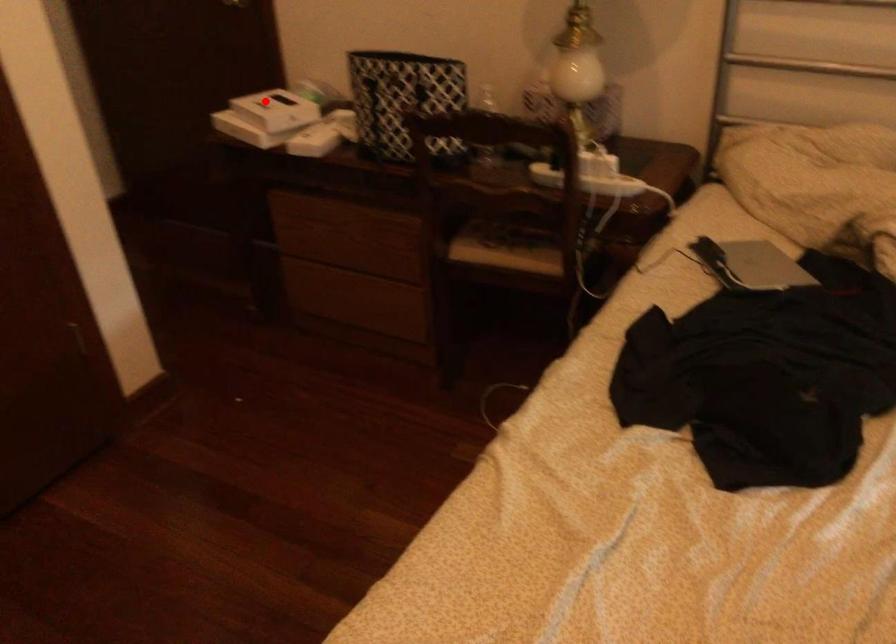
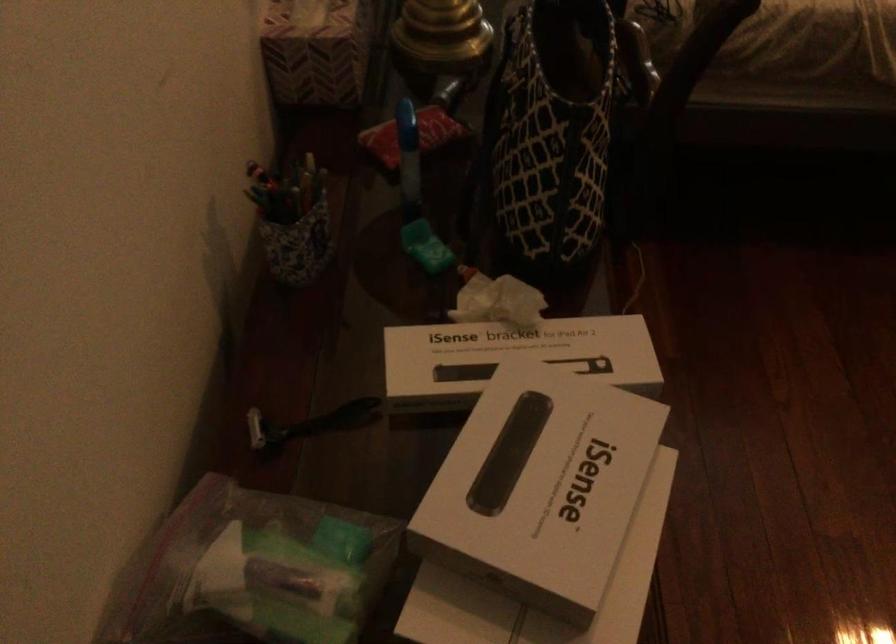
Where in the second image is the point corresponding to the highlighted location from the first image?

(540, 486)